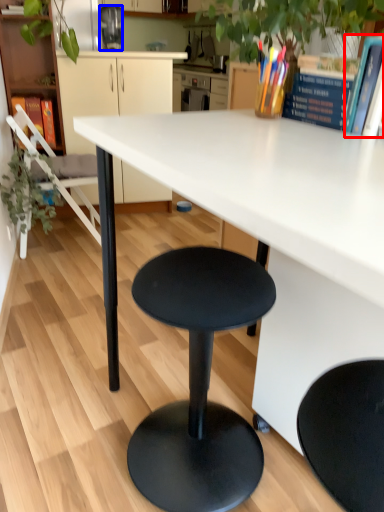
Question: Which of the following is the farthest to the observer, book (highlighted by a red box) or appliance (highlighted by a blue box)?

Choices:
 (A) book
 (B) appliance

Answer: (B)